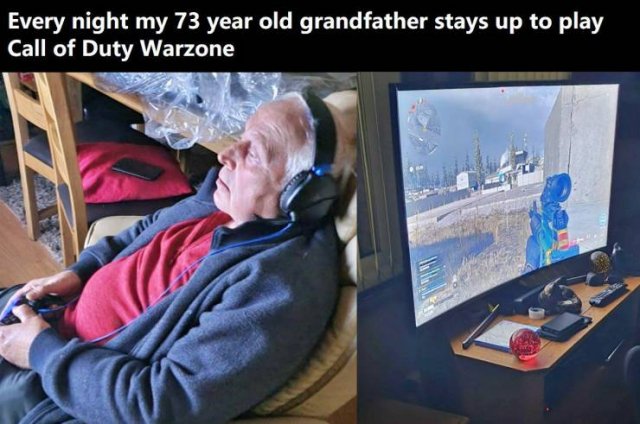
The image size is (640, 424). I want to click on tv remote, so 609,297.